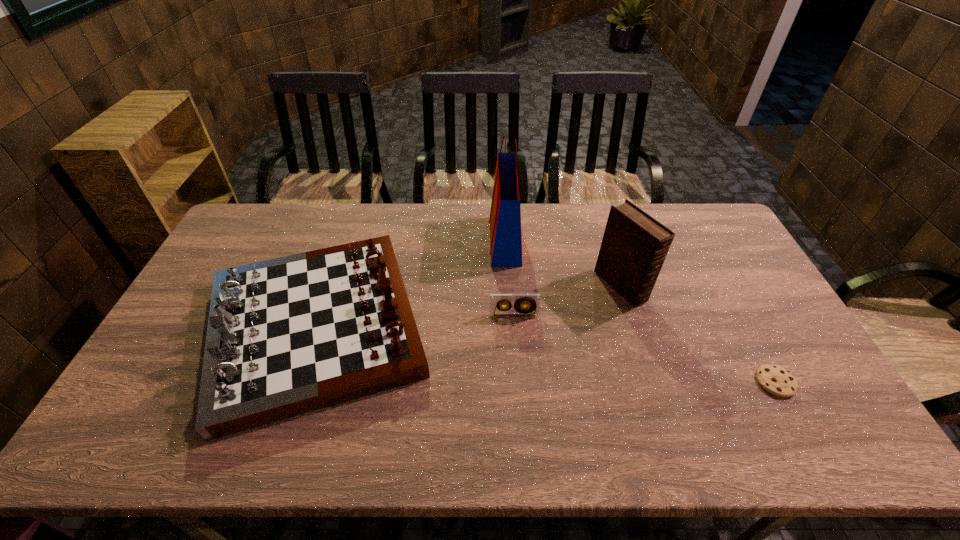
Where is `free space between the videotape and the Bible`? The height and width of the screenshot is (540, 960). free space between the videotape and the Bible is located at coordinates (567, 301).

Locate an element on the screen. The image size is (960, 540). empty space between the tallest object and the second tallest object is located at coordinates (563, 263).

At what (x,y) coordinates should I click in order to perform the action: click on free space between the fourth shortest object and the videotape. Please return your answer as a coordinate pair (x, y). The width and height of the screenshot is (960, 540). Looking at the image, I should click on click(567, 301).

This screenshot has height=540, width=960. Identify the location of free space between the Bible and the gameboard. (468, 307).

Locate an element on the screen. This screenshot has width=960, height=540. vacant space in between the fourth shortest object and the rightmost object is located at coordinates (698, 334).

At what (x,y) coordinates should I click in order to perform the action: click on free space that is in between the videotape and the third tallest object. Please return your answer as a coordinate pair (x, y). The width and height of the screenshot is (960, 540). Looking at the image, I should click on tap(415, 321).

Find the location of `free space between the Bible and the tallest object`. free space between the Bible and the tallest object is located at coordinates (563, 263).

Identify which object is the nearest to the Bible. Please provide its 2D coordinates. Your answer should be formatted as a tuple, i.e. [(x, y)], where the tuple contains the x and y coordinates of a point satisfying the conditions above.

[(497, 301)]

Identify the location of the second closest object to the fourth tallest object. The height and width of the screenshot is (540, 960). (505, 216).

The image size is (960, 540). I want to click on vacant area that satisfies the following two spatial constraints: 1. on the handle side of the second tallest object; 2. on the right side of the shopping bag, so click(x=508, y=286).